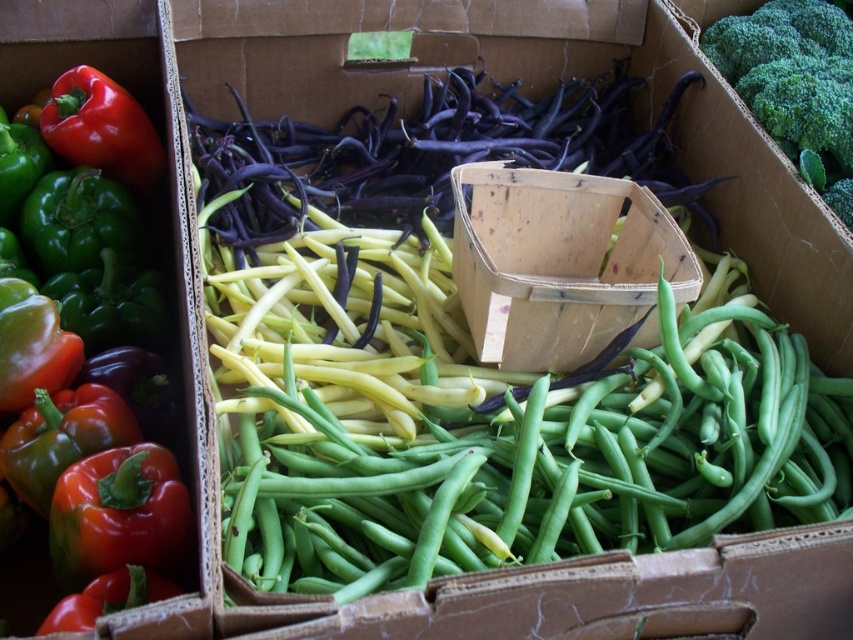
Who is more distant from viewer, (173, 429) or (733, 60)?

Positioned behind is point (733, 60).

Which is more to the left, green matte bell pepper at left or green leafy broccoli at upper right?

green matte bell pepper at left

This screenshot has width=853, height=640. In order to click on green matte bell pepper at left in this screenshot , I will do `click(80, 273)`.